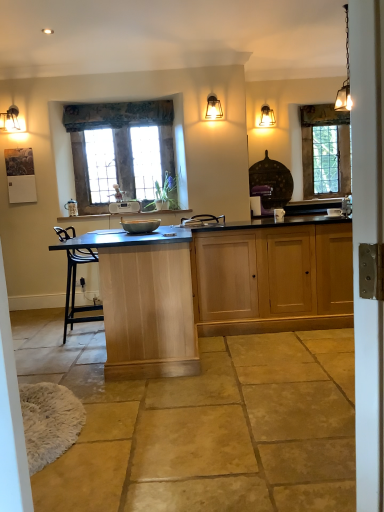
What do you see at coordinates (145, 301) in the screenshot? I see `light wood table at center` at bounding box center [145, 301].

Find the location of a particular element. The width and height of the screenshot is (384, 512). wooden-framed window at center, which ranks as the second window in back-to-front order is located at coordinates (117, 139).

Measure the distance between matte glass lamp at upper center, the 2th lamp in the back-to-front sequence, and camera.

A distance of 15.38 feet exists between matte glass lamp at upper center, the 2th lamp in the back-to-front sequence, and camera.

Image resolution: width=384 pixels, height=512 pixels. Describe the element at coordinates (117, 115) in the screenshot. I see `floral fabric curtain at upper center` at that location.

Identify the location of white plastic radio at center. (124, 207).

Where is `clear glass window at upper right, the second window from the front`? The height and width of the screenshot is (512, 384). clear glass window at upper right, the second window from the front is located at coordinates point(337,144).

Which object is positioned more to the left, wooden-framed window at center, which is the 1th window from left to right, or matte black wall sconce at upper left, the 4th lamp from the right?

From the viewer's perspective, matte black wall sconce at upper left, the 4th lamp from the right, appears more on the left side.

Where is `window that is the 1st one when counting backward from the matte black wall sconce at upper left, arranged as the 2th lamp when viewed from the front`? window that is the 1st one when counting backward from the matte black wall sconce at upper left, arranged as the 2th lamp when viewed from the front is located at coordinates (117, 139).

In terms of width, does wooden-framed window at center, which ranks as the second window in back-to-front order, look wider or thinner when compared to matte black wall sconce at upper left, arranged as the 2th lamp when viewed from the front?

Considering their sizes, wooden-framed window at center, which ranks as the second window in back-to-front order, looks slimmer than matte black wall sconce at upper left, arranged as the 2th lamp when viewed from the front.

Considering the positions of objects matte glass pendant light at upper right, the 1th lamp positioned from the back, and white glossy door at right in the image provided, who is more to the right, matte glass pendant light at upper right, the 1th lamp positioned from the back, or white glossy door at right?

Positioned to the right is matte glass pendant light at upper right, the 1th lamp positioned from the back.

How different are the orientations of matte glass pendant light at upper right, which is the 3th lamp from left to right, and white glossy door at right in degrees?

125 degrees.

Which object is thinner, matte glass pendant light at upper right, which is the 3th lamp from left to right, or white glossy door at right?

white glossy door at right.

Is matte glass pendant light at upper right, which is the 3th lamp from left to right, looking in the opposite direction of white glossy door at right?

No, matte glass pendant light at upper right, which is the 3th lamp from left to right,'s orientation is not away from white glossy door at right.

Considering the sizes of light wood cabinet at center and light wood table at center in the image, is light wood cabinet at center taller or shorter than light wood table at center?

light wood cabinet at center is shorter than light wood table at center.

Identify the location of table above the light wood cabinet at center (from a real-world perspective). Image resolution: width=384 pixels, height=512 pixels. (145, 301).

Which of these two, light wood cabinet at center or light wood table at center, is thinner?

light wood cabinet at center.

From a real-world perspective, which object stands above the other?

floral fabric curtain at upper center is physically above.

How different are the orientations of wooden-framed window at center, which ranks as the second window in back-to-front order, and floral fabric curtain at upper center in degrees?

0.0103 degrees.

Would you say wooden-framed window at center, which is the second window from right to left, is to the left or to the right of floral fabric curtain at upper center in the picture?

Based on their positions, wooden-framed window at center, which is the second window from right to left, is located to the right of floral fabric curtain at upper center.

Who is bigger, wooden-framed window at center, which is the 1th window from left to right, or floral fabric curtain at upper center?

Bigger between the two is wooden-framed window at center, which is the 1th window from left to right.

Looking at this image, is wooden-framed window at center, which appears as the first window when viewed from the front, shorter than metallic chain-link lamp at upper right, which is the fourth lamp in left-to-right order?

No.

Could you tell me if wooden-framed window at center, which appears as the first window when viewed from the front, is facing metallic chain-link lamp at upper right, placed as the fourth lamp when sorted from back to front?

No.

Is wooden-framed window at center, which appears as the first window when viewed from the front, positioned before metallic chain-link lamp at upper right, which appears as the first lamp when viewed from the right?

No, wooden-framed window at center, which appears as the first window when viewed from the front, is further to the viewer.

Is point (119, 178) in front of point (342, 89)?

No.

Can you tell me how much matte glass pendant light at upper right, the 1th lamp positioned from the back, and matte gray bowl at center differ in facing direction?

The angular difference between matte glass pendant light at upper right, the 1th lamp positioned from the back, and matte gray bowl at center is 92.1 degrees.

Between matte glass pendant light at upper right, the 1th lamp positioned from the back, and matte gray bowl at center, which one is positioned behind?

matte glass pendant light at upper right, the 1th lamp positioned from the back, is behind.

Is matte glass pendant light at upper right, the 2th lamp in the right-to-left sequence, taller or shorter than matte gray bowl at center?

In the image, matte glass pendant light at upper right, the 2th lamp in the right-to-left sequence, appears to be taller than matte gray bowl at center.

Is matte glass pendant light at upper right, which is the 3th lamp from left to right, oriented towards matte gray bowl at center?

No, matte glass pendant light at upper right, which is the 3th lamp from left to right, does not turn towards matte gray bowl at center.

From a real-world perspective, is matte glass pendant light at upper right, the 4th lamp in the front-to-back sequence, on top of matte glass lamp at upper center, the 2th lamp when ordered from left to right?

Yes, from a real-world perspective, matte glass pendant light at upper right, the 4th lamp in the front-to-back sequence, is above matte glass lamp at upper center, the 2th lamp when ordered from left to right.

Can you confirm if matte glass pendant light at upper right, the 4th lamp in the front-to-back sequence, is shorter than matte glass lamp at upper center, the 2th lamp in the back-to-front sequence?

Indeed, matte glass pendant light at upper right, the 4th lamp in the front-to-back sequence, has a lesser height compared to matte glass lamp at upper center, the 2th lamp in the back-to-front sequence.

The height and width of the screenshot is (512, 384). I want to click on lamp that is behind the matte glass lamp at upper center, the 2th lamp when ordered from left to right, so click(x=267, y=117).

Is matte glass pendant light at upper right, which is the 3th lamp from left to right, not near matte glass lamp at upper center, the third lamp viewed from the front?

Absolutely, matte glass pendant light at upper right, which is the 3th lamp from left to right, is distant from matte glass lamp at upper center, the third lamp viewed from the front.

Locate an element on the screen. The width and height of the screenshot is (384, 512). lamp on the left of wooden-framed window at center, which is the 1th window from left to right is located at coordinates (10, 120).

Locate an element on the screen. The height and width of the screenshot is (512, 384). lamp that is the 4th one when counting upward from the white glossy door at right (from the image's perspective) is located at coordinates (267, 117).

Based on their spatial positions, is floral fabric curtain at upper center or clear glass window at upper right, the first window viewed from the right, further from light wood table at center?

clear glass window at upper right, the first window viewed from the right, lies further to light wood table at center than the other object.

In the scene shown: When comparing their distances from white glossy door at right, does clear glass window at upper right, the first window viewed from the right, or matte glass lamp at upper center, the third lamp viewed from the right, seem further?

Based on the image, clear glass window at upper right, the first window viewed from the right, appears to be further to white glossy door at right.

Based on their spatial positions, is white glossy door at right or clear glass window at upper right, the second window from the front, further from matte black wall sconce at upper left, arranged as the 2th lamp when viewed from the front?

white glossy door at right is further to matte black wall sconce at upper left, arranged as the 2th lamp when viewed from the front.

Which object lies further to the anchor point matte black wall sconce at upper left, arranged as the 2th lamp when viewed from the front, floral fabric curtain at upper center or matte glass pendant light at upper right, the 2th lamp in the right-to-left sequence?

matte glass pendant light at upper right, the 2th lamp in the right-to-left sequence.

Which object lies further to the anchor point matte gray bowl at center, matte glass lamp at upper center, the third lamp viewed from the right, or matte black wall sconce at upper left, arranged as the 2th lamp when viewed from the front?

Based on the image, matte black wall sconce at upper left, arranged as the 2th lamp when viewed from the front, appears to be further to matte gray bowl at center.

When comparing their distances from metallic chain-link lamp at upper right, which is the fourth lamp in left-to-right order, does matte gray bowl at center or light wood table at center seem closer?

light wood table at center is positioned closer to the anchor metallic chain-link lamp at upper right, which is the fourth lamp in left-to-right order.

When comparing their distances from floral fabric curtain at upper center, does metallic chain-link lamp at upper right, which ranks as the 1th lamp in front-to-back order, or clear glass window at upper right, the first window viewed from the back, seem closer?

metallic chain-link lamp at upper right, which ranks as the 1th lamp in front-to-back order, is positioned closer to the anchor floral fabric curtain at upper center.

Based on their spatial positions, is metallic chain-link lamp at upper right, which is the fourth lamp in left-to-right order, or white plastic radio at center closer to light wood cabinet at center?

metallic chain-link lamp at upper right, which is the fourth lamp in left-to-right order, is positioned closer to the anchor light wood cabinet at center.

The height and width of the screenshot is (512, 384). Identify the location of cabinetry positioned between matte gray bowl at center and white plastic radio at center from near to far. (273, 279).

I want to click on table situated between matte black wall sconce at upper left, the 4th lamp from the right, and matte glass pendant light at upper right, the 1th lamp positioned from the back, from left to right, so click(145, 301).

Find the location of a particular element. This screenshot has height=512, width=384. cabinetry located between white glossy door at right and matte glass pendant light at upper right, the 4th lamp in the front-to-back sequence, in the depth direction is located at coordinates (273, 279).

I want to click on curtain between matte black wall sconce at upper left, the 1th lamp from the left, and white plastic radio at center, in the horizontal direction, so click(117, 115).